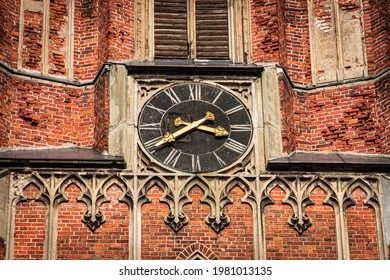
Identify the location of archway. (195, 249).